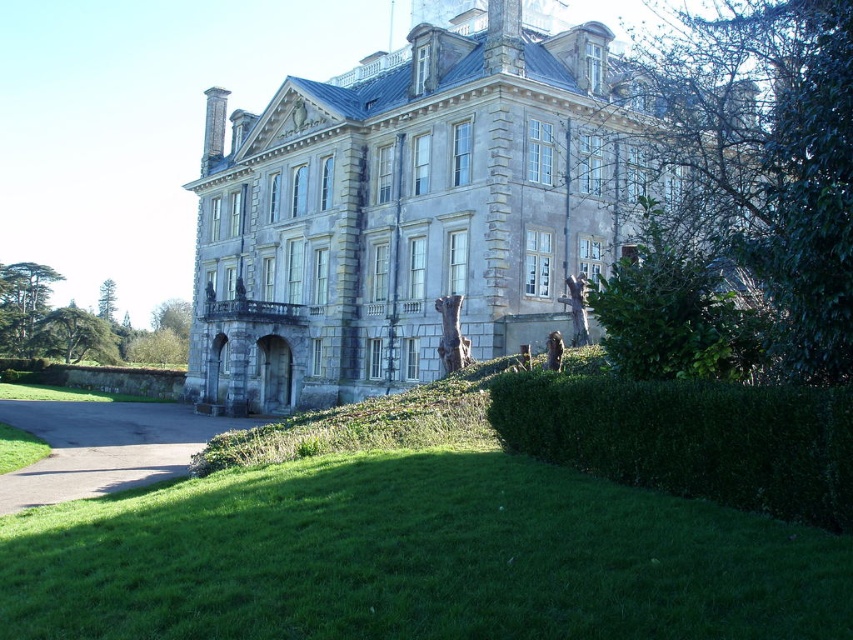
Question: Observing the image, what is the correct spatial positioning of green grass at lower center in reference to gray asphalt driveway at lower left?

Choices:
 (A) left
 (B) right

Answer: (B)

Question: Among these points, which one is farthest from the camera?

Choices:
 (A) (796, 472)
 (B) (610, 170)
 (C) (160, 468)

Answer: (B)

Question: Which point is farther from the camera taking this photo?

Choices:
 (A) (277, 390)
 (B) (590, 504)

Answer: (A)

Question: Which of these objects is positioned closest to the green grass at lower center?

Choices:
 (A) green leafy hedge at lower right
 (B) gray asphalt driveway at lower left
 (C) gray stone palace at center

Answer: (A)

Question: Does gray stone palace at center have a smaller size compared to gray asphalt driveway at lower left?

Choices:
 (A) no
 (B) yes

Answer: (A)

Question: Is green leafy hedge at lower right to the left of gray asphalt driveway at lower left from the viewer's perspective?

Choices:
 (A) yes
 (B) no

Answer: (B)